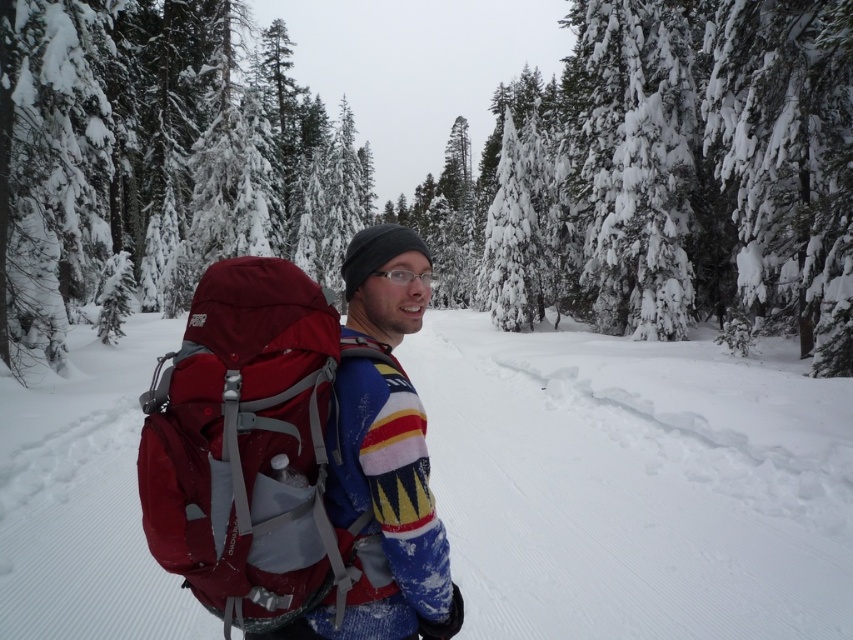
You are a photographer trying to capture a closeup of the clear plastic glasses at center. However, the knitted wool sweater at center is blocking your view. Can you determine if the glasses are visible through the sweater?

The knitted wool sweater at center is in front of the clear plastic glasses at center, so the glasses are not visible through the sweater.

You are trying to determine if the white fluffy snow at center can completely cover the clear plastic glasses at center. Based on the spatial relationship between them, what do you think?

The white fluffy snow at center is wider than clear plastic glasses at center, so it can completely cover the clear plastic glasses at center.

You are the person in the winter scene. You want to place your clear plastic glasses at center on the white fluffy snow at center. Will the glasses fit entirely on the snow?

The white fluffy snow at center has a larger size compared to clear plastic glasses at center, so yes, the glasses will fit entirely on the snow.